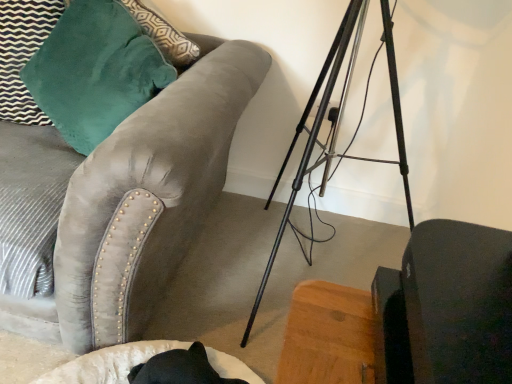
Question: From a real-world perspective, is matte black swivel chair at lower right above or below velvet teal pillow at upper left?

Choices:
 (A) below
 (B) above

Answer: (B)

Question: Considering the positions of point (480, 241) and point (51, 84), is point (480, 241) closer or farther from the camera than point (51, 84)?

Choices:
 (A) farther
 (B) closer

Answer: (B)

Question: Which object is positioned closest to the matte black swivel chair at lower right?

Choices:
 (A) velvet teal pillow at upper left
 (B) velvet gray couch at upper left

Answer: (B)

Question: Estimate the real-world distances between objects in this image. Which object is farther from the matte black swivel chair at lower right?

Choices:
 (A) velvet teal pillow at upper left
 (B) velvet gray couch at upper left

Answer: (A)